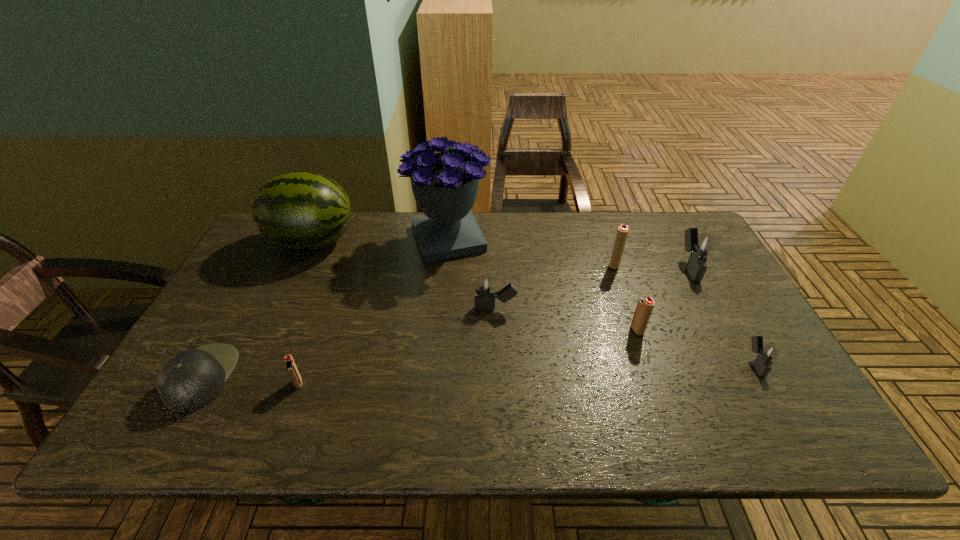
Where is `purple bouquet`? purple bouquet is located at coordinates (445, 185).

Find the location of a particular element. The height and width of the screenshot is (540, 960). the tallest object is located at coordinates (445, 185).

Where is `watermelon`? This screenshot has height=540, width=960. watermelon is located at coordinates (300, 210).

This screenshot has width=960, height=540. I want to click on the second tallest object, so click(300, 210).

The image size is (960, 540). In order to click on the biggest red igniter in this screenshot , I will do `click(622, 232)`.

Where is `the farthest gray igniter`? the farthest gray igniter is located at coordinates (700, 246).

This screenshot has height=540, width=960. I want to click on the second igniter from left to right, so click(485, 293).

Where is `the second biggest gray igniter`? the second biggest gray igniter is located at coordinates (485, 293).

Where is `the second smallest red igniter`? the second smallest red igniter is located at coordinates (645, 305).

Identify the location of the sixth farthest object. Image resolution: width=960 pixels, height=540 pixels. (645, 305).